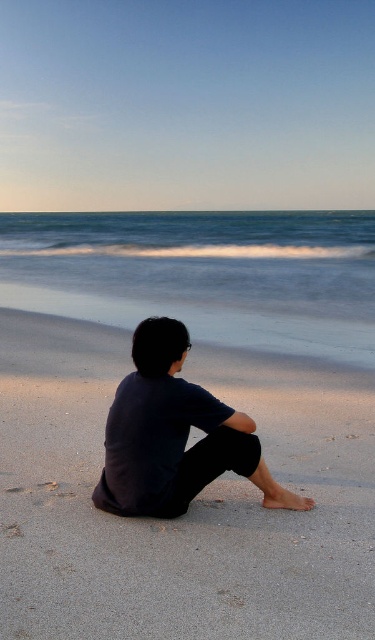
You are standing at the point marked as point (190, 506) on the beach. What is the type of terrain you are currently standing on?

The point (190, 506) corresponds to sandy at lower center, so you are standing on sandy terrain.

You are standing on the beach and see the sandy at lower center and the dark blue fabric at center. Which object is closer to the ground?

The sandy at lower center is positioned under dark blue fabric at center, so it is closer to the ground.

You are standing at the point labeled point (205, 426) and want to walk to the ocean. Is the point labeled point (91, 636) between you and the ocean?

Yes, the point labeled point (91, 636) is between you and the ocean because it is in front of point (205, 426), which is your current position.